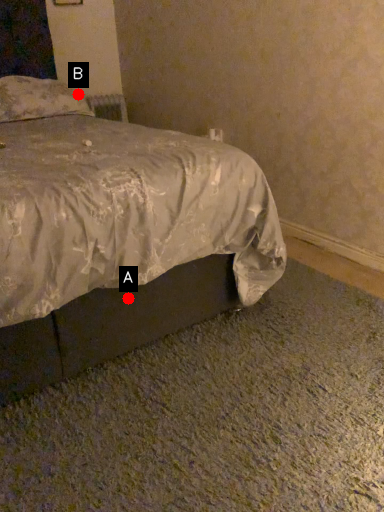
Question: Two points are circled on the image, labeled by A and B beside each circle. Which point is further to the camera?

Choices:
 (A) A is further
 (B) B is further

Answer: (B)